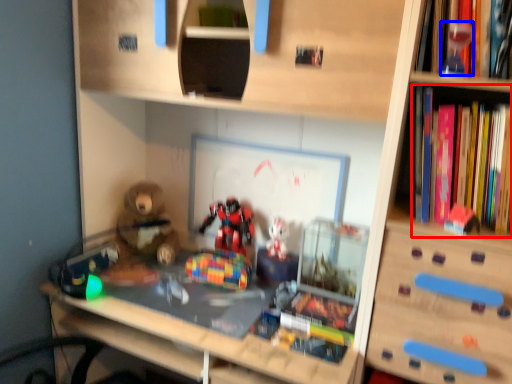
Question: Which object is further to the camera taking this photo, book (highlighted by a red box) or toy (highlighted by a blue box)?

Choices:
 (A) book
 (B) toy

Answer: (B)